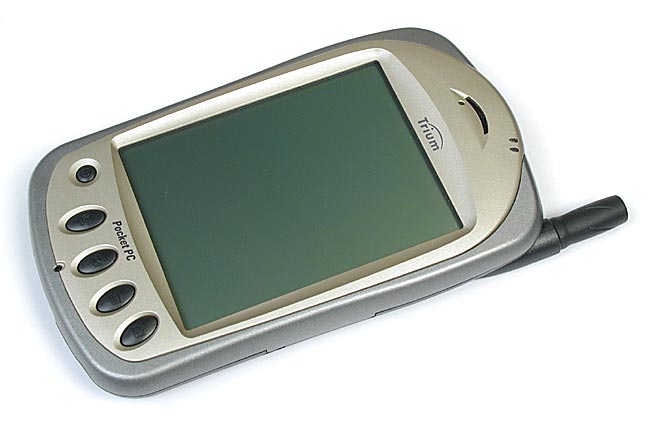
Locate an element on the screen. The image size is (650, 421). phone is located at coordinates (510, 239).